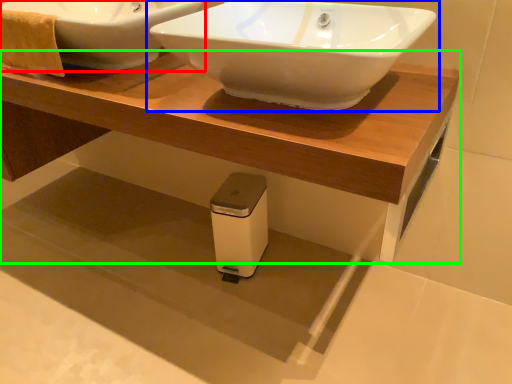
Question: Considering the real-world distances, which object is closest to sink (highlighted by a red box)? sink (highlighted by a blue box) or table (highlighted by a green box).

Choices:
 (A) sink
 (B) table

Answer: (B)